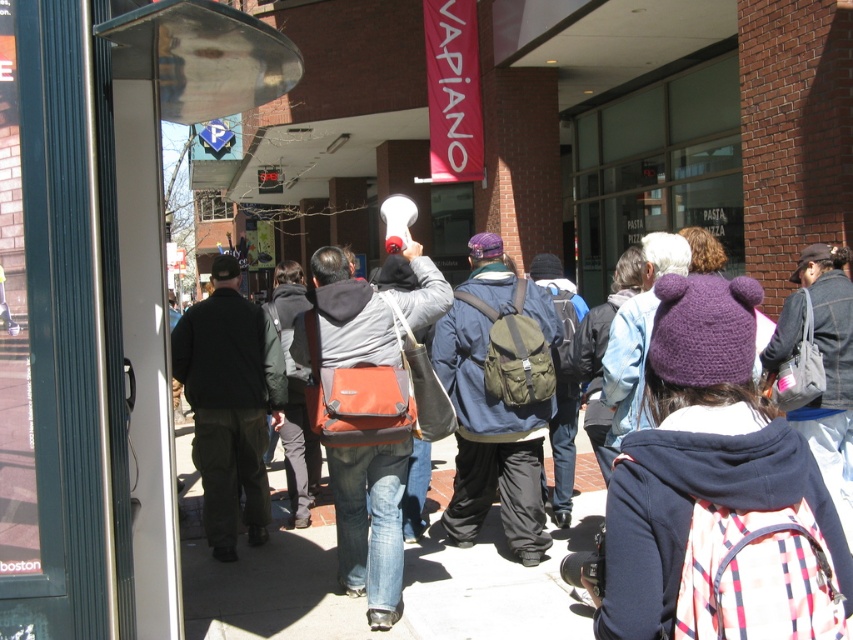
Is point (726, 380) farther from viewer compared to point (527, 284)?

No, (726, 380) is closer to viewer.

Is plaid fabric backpack at center to the left of matte green backpack at center from the viewer's perspective?

No, plaid fabric backpack at center is not to the left of matte green backpack at center.

What are the coordinates of `plaid fabric backpack at center` in the screenshot? It's located at (701, 456).

Between orange fabric messenger bag at center and black cotton jacket at center, which one appears on the left side from the viewer's perspective?

black cotton jacket at center is more to the left.

Is orange fabric messenger bag at center bigger than black cotton jacket at center?

Actually, orange fabric messenger bag at center might be smaller than black cotton jacket at center.

Does point (426, 289) lie behind point (222, 275)?

That is False.

Where is `orange fabric messenger bag at center`? Image resolution: width=853 pixels, height=640 pixels. orange fabric messenger bag at center is located at coordinates (370, 524).

Does matte green backpack at center have a greater height compared to orange fabric messenger bag at center?

Indeed, matte green backpack at center has a greater height compared to orange fabric messenger bag at center.

Is matte green backpack at center bigger than orange fabric messenger bag at center?

Yes, matte green backpack at center is bigger than orange fabric messenger bag at center.

You are a GUI agent. You are given a task and a screenshot of the screen. Output one action in this format:
    pyautogui.click(x=<x>, y=<y>)
    Task: Click on the matte green backpack at center
    
    Given the screenshot: What is the action you would take?
    pyautogui.click(x=498, y=397)

I want to click on matte green backpack at center, so click(x=498, y=397).